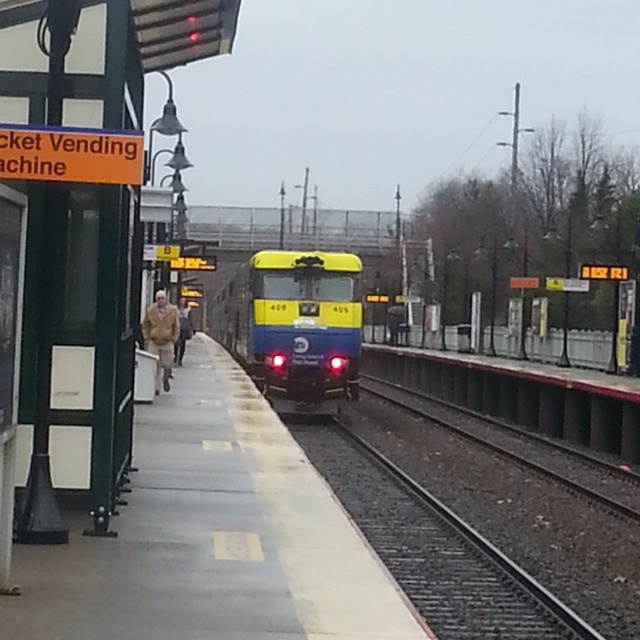
Question: Which of the following is the farthest from the observer?

Choices:
 (A) brown leather jacket at left
 (B) yellow matte train at center

Answer: (B)

Question: Is smooth concrete platform at center positioned behind yellow matte train at center?

Choices:
 (A) yes
 (B) no

Answer: (B)

Question: Among these points, which one is nearest to the camera?

Choices:
 (A) (170, 376)
 (B) (177, 508)

Answer: (B)

Question: In this image, where is yellow matte train at center located relative to brown leather jacket at left?

Choices:
 (A) above
 (B) below

Answer: (A)

Question: Can you confirm if yellow matte train at center is wider than brown leather jacket at center?

Choices:
 (A) no
 (B) yes

Answer: (B)

Question: Which point is closer to the camera taking this photo?

Choices:
 (A) (241, 580)
 (B) (156, 324)

Answer: (A)